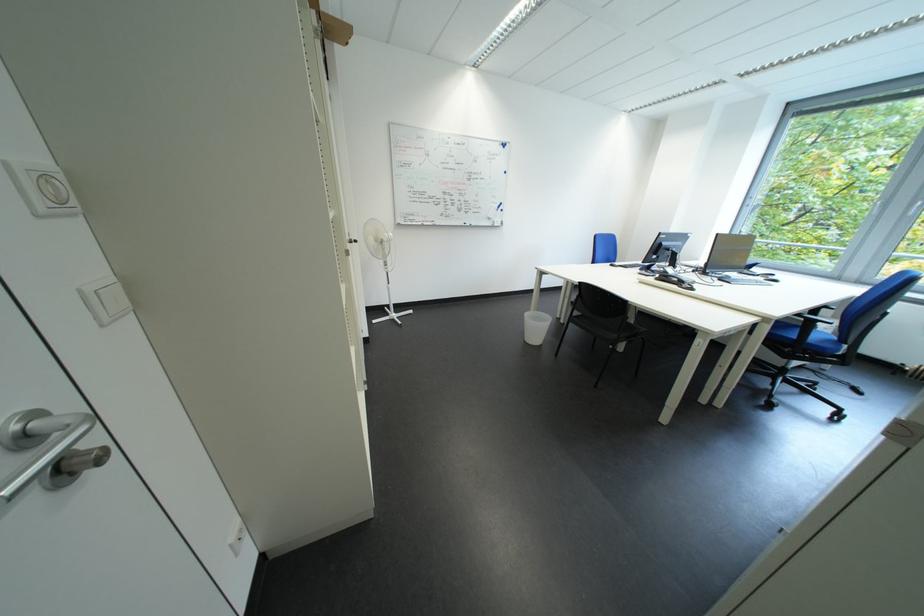
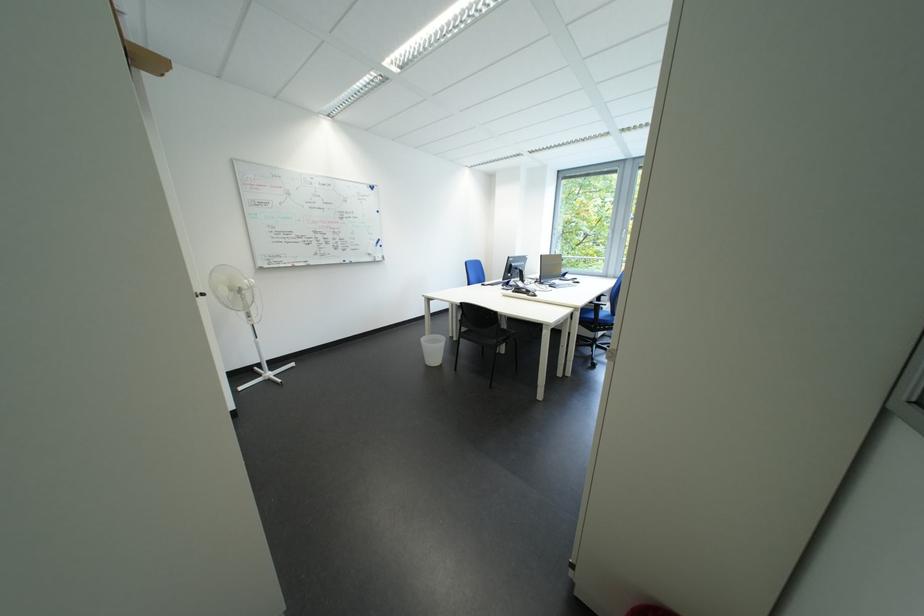
Question: The images are taken continuously from a first-person perspective. In which direction are you moving?

Choices:
 (A) Left
 (B) Right
 (C) Forward
 (D) Backward

Answer: (D)